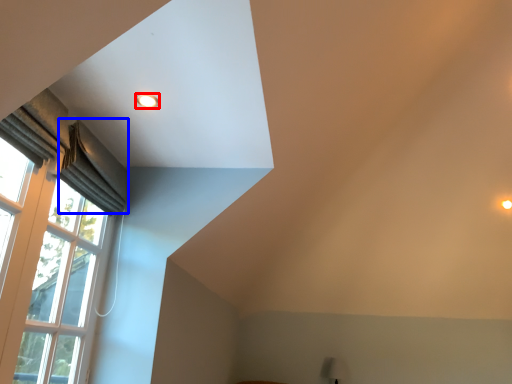
Question: Among these objects, which one is nearest to the camera, lighting (highlighted by a red box) or curtain (highlighted by a blue box)?

Choices:
 (A) lighting
 (B) curtain

Answer: (A)